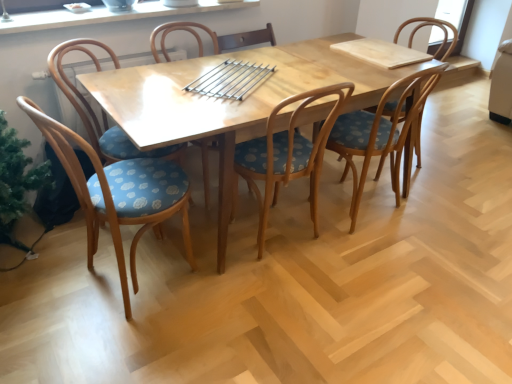
The width and height of the screenshot is (512, 384). In order to click on vacant space in front of wooden chair with blue polka dot seat cushion at center, which is counted as the 5th chair, starting from the left in this screenshot , I will do `click(393, 266)`.